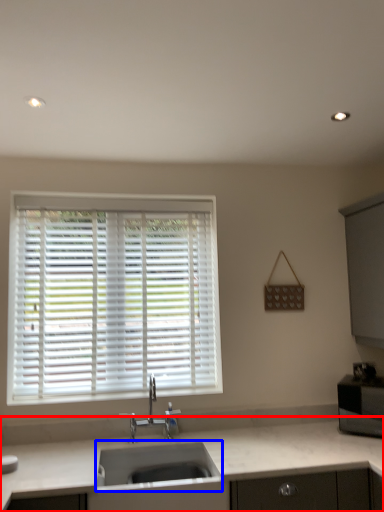
Question: Which object appears closest to the camera in this image, countertop (highlighted by a red box) or sink (highlighted by a blue box)?

Choices:
 (A) countertop
 (B) sink

Answer: (A)